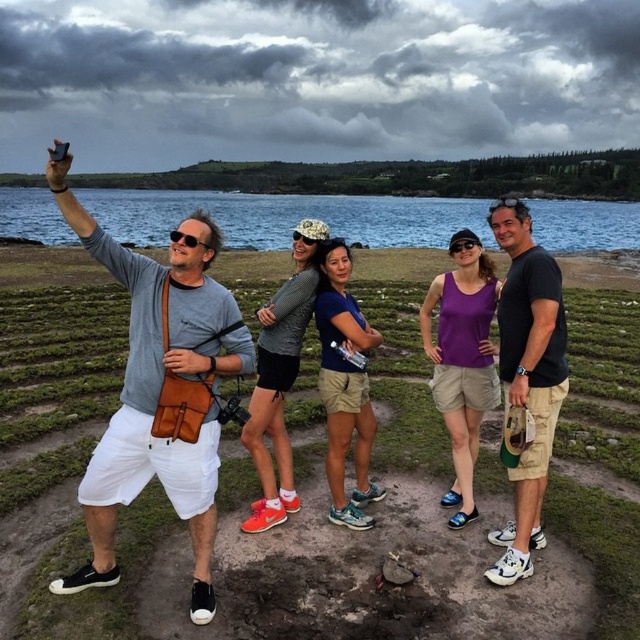
Question: Is purple matte tank top at center positioned before blue fabric shirt at center?

Choices:
 (A) yes
 (B) no

Answer: (B)

Question: Can you confirm if purple matte tank top at center is wider than matte gray tank top at center?

Choices:
 (A) no
 (B) yes

Answer: (B)

Question: Considering the real-world distances, which object is closest to the matte black sunglasses at center?

Choices:
 (A) blue fabric shirt at center
 (B) matte gray tank top at center

Answer: (A)

Question: Among these points, which one is farthest from the camera?

Choices:
 (A) (340, 323)
 (B) (433, 460)
 (C) (529, 406)

Answer: (B)

Question: Which object is the farthest from the blue water at upper center?

Choices:
 (A) brown dirt field at center
 (B) black cotton t-shirt at right
 (C) matte gray tank top at center

Answer: (C)

Question: From the image, what is the correct spatial relationship of blue water at upper center in relation to blue fabric shirt at center?

Choices:
 (A) left
 (B) right

Answer: (A)